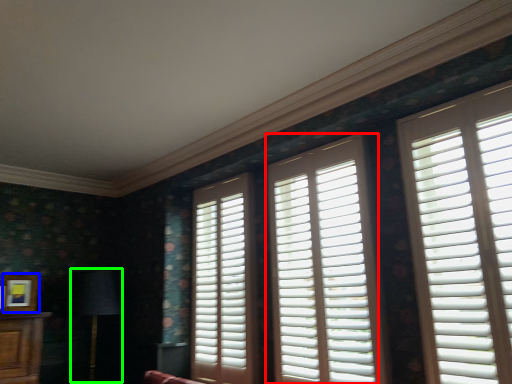
Question: Which object is positioned closest to window (highlighted by a red box)? Select from picture frame (highlighted by a blue box) and table lamp (highlighted by a green box).

Choices:
 (A) picture frame
 (B) table lamp

Answer: (B)